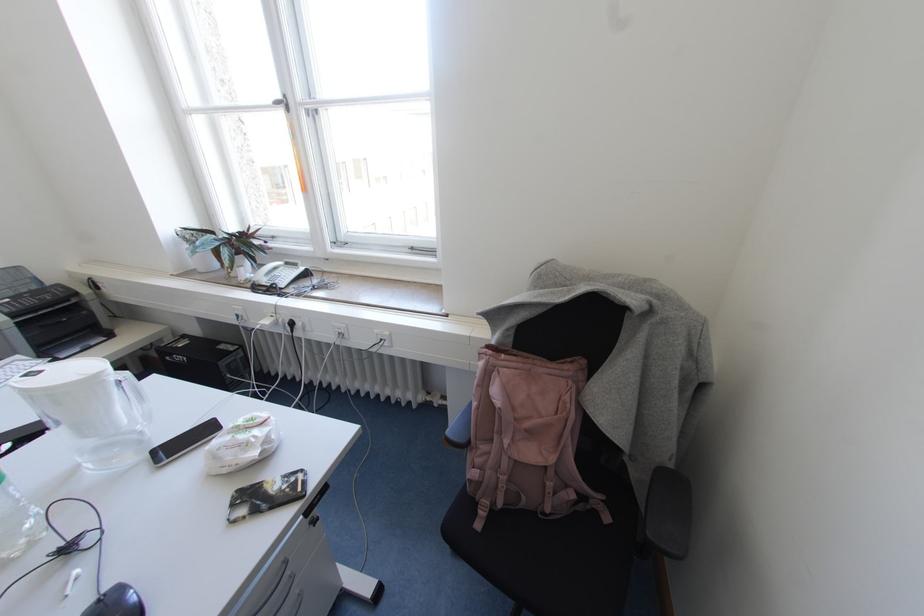
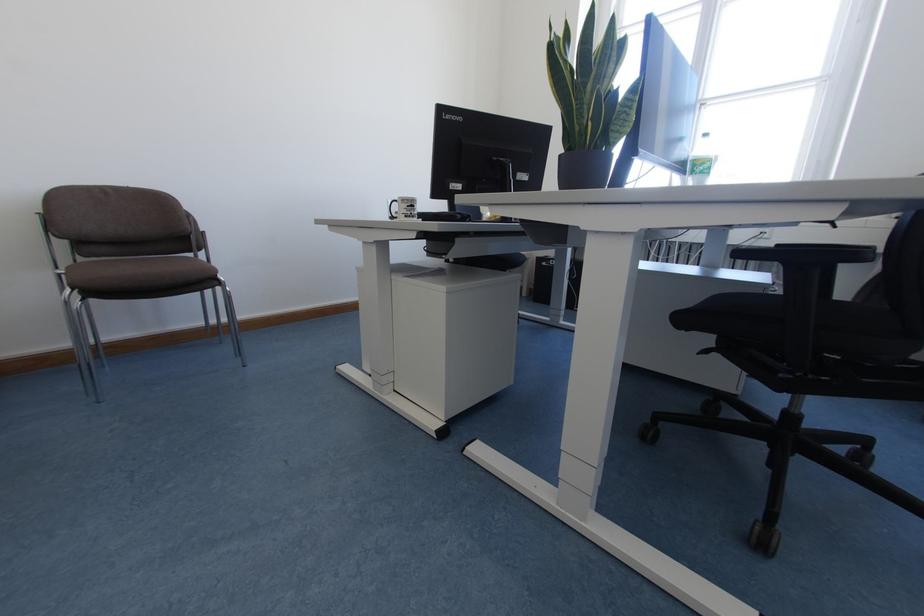
Which direction would the cameraman need to move to produce the second image?

The cameraman walked toward left, backward.